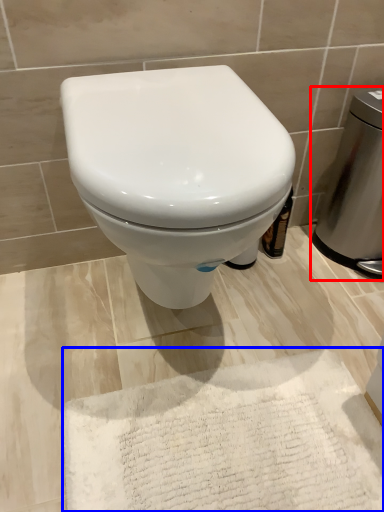
Question: Which of the following is the farthest to the observer, appliance (highlighted by a red box) or bath mat (highlighted by a blue box)?

Choices:
 (A) appliance
 (B) bath mat

Answer: (A)